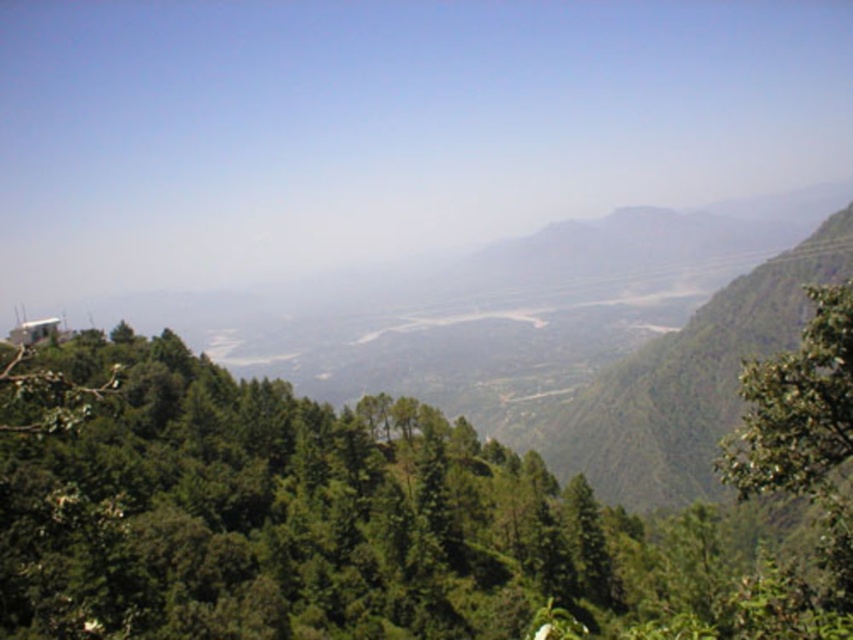
Question: Is green leafy tree at center wider than green leafy tree at right?

Choices:
 (A) no
 (B) yes

Answer: (A)

Question: Does green leafy tree at center have a greater width compared to green leafy tree at right?

Choices:
 (A) no
 (B) yes

Answer: (A)

Question: Which of the following is the closest to the observer?

Choices:
 (A) green leafy tree at right
 (B) green leafy tree at center

Answer: (B)

Question: Is green leafy tree at center smaller than green leafy tree at right?

Choices:
 (A) yes
 (B) no

Answer: (A)